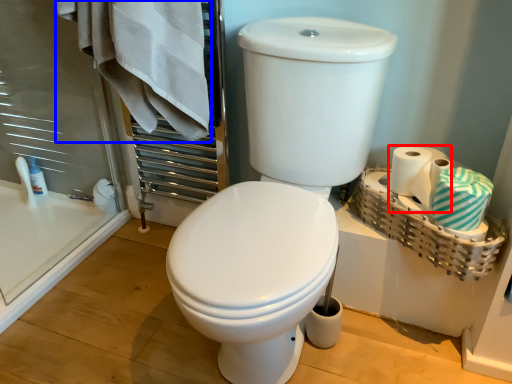
Question: Which of the following is the farthest to the observer, toilet paper (highlighted by a red box) or bath towel (highlighted by a blue box)?

Choices:
 (A) toilet paper
 (B) bath towel

Answer: (A)